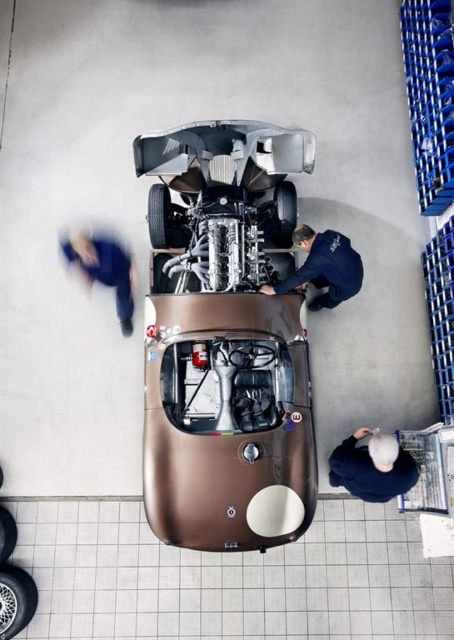
Please provide the coordinates of the shiny metallic race car at center in the image. The coordinates should be in the format of a point with two decimal places, such as point (x=225, y=339). The scene is an overhead view of a vintage racing car in a garage with three people working on it.

The shiny metallic race car at center is located at point (x=225, y=339).

You are a mechanic in the garage and need to hand a tool to the person wearing the dark blue shirt at lower right and the dark blue uniform at center. Which of the two is closer to you?

The dark blue shirt at lower right is located below the dark blue uniform at center, so the dark blue uniform at center is closer to you.